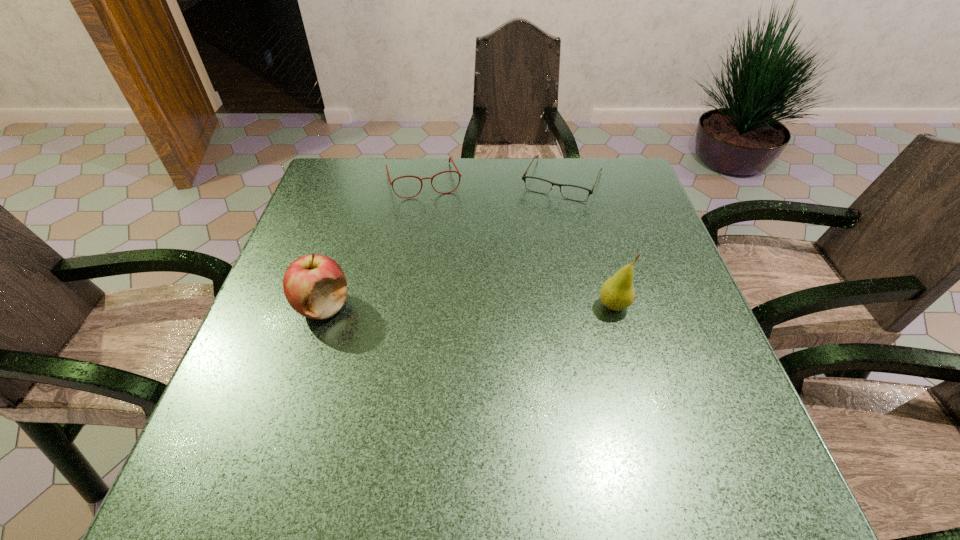
This screenshot has height=540, width=960. Identify the location of apple. (315, 286).

The height and width of the screenshot is (540, 960). Find the location of `pear`. pear is located at coordinates (617, 293).

Identify the location of the taller spectacles. Image resolution: width=960 pixels, height=540 pixels. (450, 158).

You are a GUI agent. You are given a task and a screenshot of the screen. Output one action in this format:
    pyautogui.click(x=<x>, y=<y>)
    Task: Click on the left spectacles
    
    Given the screenshot: What is the action you would take?
    pyautogui.click(x=450, y=158)

At what (x,y) coordinates should I click in order to perform the action: click on the right spectacles. Please return your answer as a coordinate pair (x, y). This screenshot has height=540, width=960. Looking at the image, I should click on (572, 192).

You are a GUI agent. You are given a task and a screenshot of the screen. Output one action in this format:
    pyautogui.click(x=<x>, y=<y>)
    Task: Click on the shortest object
    This screenshot has width=960, height=540.
    Given the screenshot: What is the action you would take?
    pyautogui.click(x=572, y=192)

This screenshot has height=540, width=960. I want to click on vacant area situated on the bitten side of the apple, so click(x=299, y=381).

Locate an element on the screen. free space located on the front of the pear is located at coordinates (625, 350).

Identify the location of free space located 0.250m on the face of the third tallest object. (446, 262).

Find the location of a particular element. vacant region located 0.170m on the face of the third tallest object is located at coordinates (441, 240).